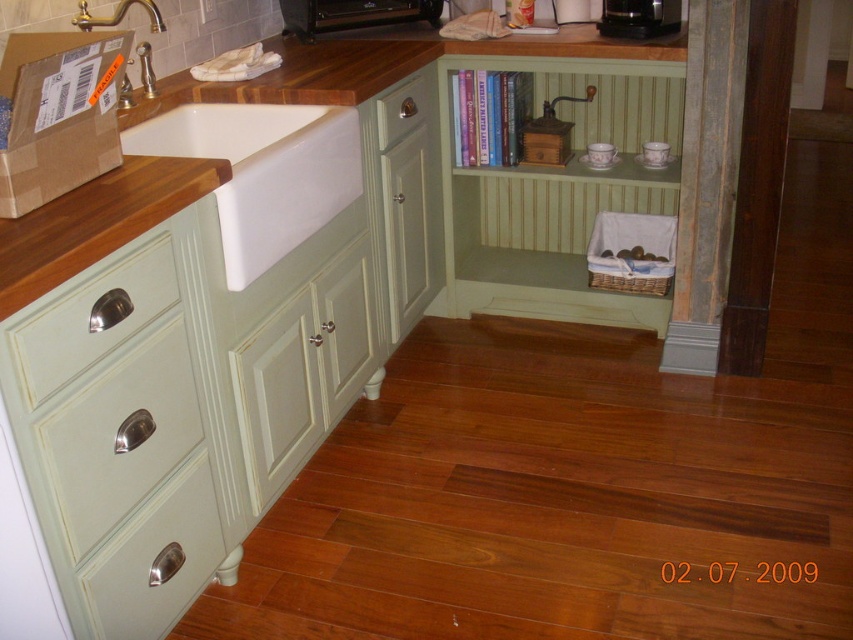
From the picture: You are a chef preparing to place a hot pan on the brown wood countertop at upper left near the brushed metal faucet at upper left. Considering their positions, will the pan be closer to the edge of the countertop or the faucet?

The brown wood countertop at upper left is in front of the brushed metal faucet at upper left, so placing the pan on the countertop near the faucet would position it closer to the faucet rather than the edge.

You are organizing a small kitchen appliance that is 12 inches wide. You have to place it either on the brown wood countertop at upper left or in the white glossy drawer at lower left. Which location can accommodate the appliance based on their widths?

The brown wood countertop at upper left might be wider than the white glossy drawer at lower left, so it is possible that the countertop has enough space for the 12 inch appliance. However, since the exact width of the drawer is unknown, the safest choice would be to place it on the brown wood countertop at upper left.

Looking at this image, you are trying to place a small herb pot on the brown wood countertop at upper left near the brushed metal faucet at upper left. Based on their positions, will the herb pot fit between them?

The brown wood countertop at upper left is positioned on the right side of the brushed metal faucet at upper left, meaning there is space between them. The herb pot should fit as long as its size is smaller than the available space between the two objects.